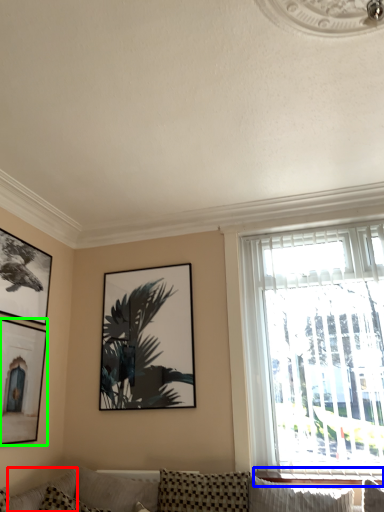
Question: Estimate the real-world distances between objects in this image. Which object is closer to pillow (highlighted by a red box), window sill (highlighted by a blue box) or picture frame (highlighted by a green box)?

Choices:
 (A) window sill
 (B) picture frame

Answer: (B)